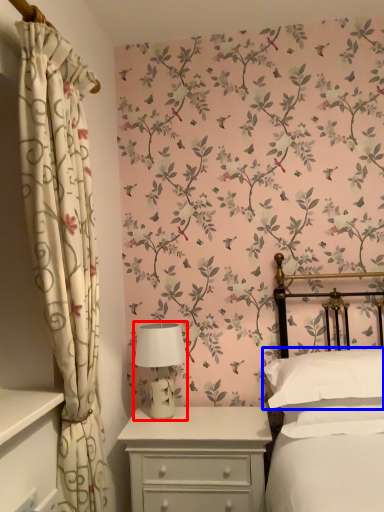
Question: Which point is further to the camera, table lamp (highlighted by a red box) or pillow (highlighted by a blue box)?

Choices:
 (A) table lamp
 (B) pillow

Answer: (A)